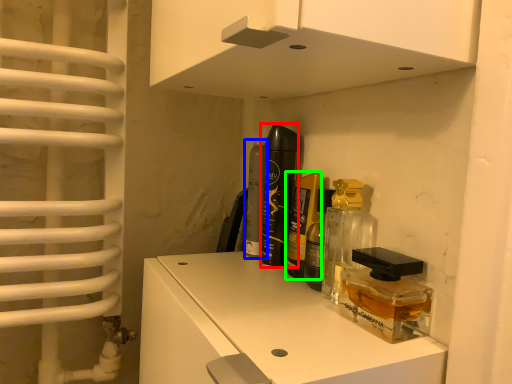
Question: Which object is positioned farthest from perfume (highlighted by a red box)? Select from perfume (highlighted by a blue box) and perfume (highlighted by a green box).

Choices:
 (A) perfume
 (B) perfume

Answer: (A)